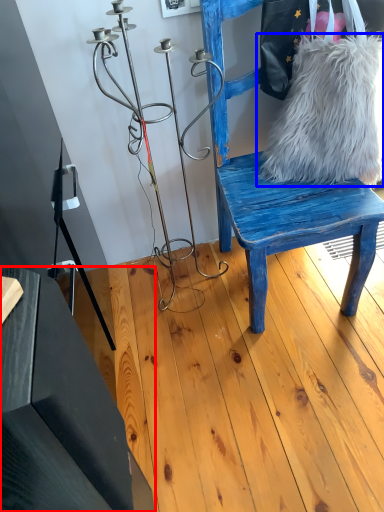
Question: Which object is closer to the camera taking this photo, table (highlighted by a red box) or fur (highlighted by a blue box)?

Choices:
 (A) table
 (B) fur

Answer: (A)